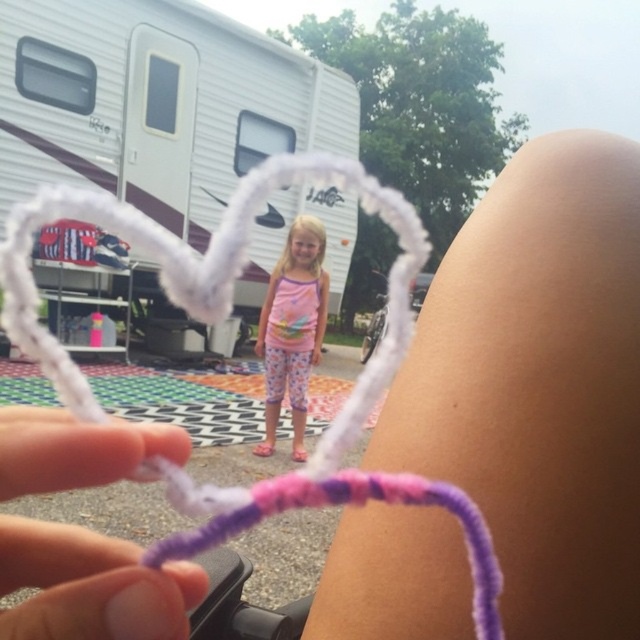
Question: Does white plastic recreational vehicle at upper left have a greater width compared to purple yarn at lower left?

Choices:
 (A) yes
 (B) no

Answer: (A)

Question: Is white plastic recreational vehicle at upper left smaller than pink fabric pants at center?

Choices:
 (A) no
 (B) yes

Answer: (A)

Question: Which point is closer to the camera?

Choices:
 (A) purple yarn at lower left
 (B) white plastic recreational vehicle at center

Answer: (A)

Question: Which object is closer to the camera taking this photo?

Choices:
 (A) purple yarn at lower left
 (B) pink fabric pants at center
 (C) white/yarn heart at center

Answer: (A)

Question: Observing the image, what is the correct spatial positioning of white plastic recreational vehicle at upper left in reference to pink fabric pants at center?

Choices:
 (A) left
 (B) right

Answer: (A)

Question: Which of the following is the farthest from the observer?

Choices:
 (A) white/yarn heart at center
 (B) purple yarn at lower left

Answer: (A)